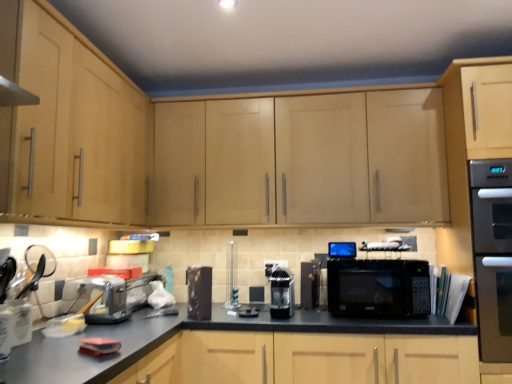
Question: In which direction should I rotate to look at sleek black coffee machine at center, which appears as the third appliance when viewed from the left?

Choices:
 (A) left
 (B) right

Answer: (B)

Question: From the image's perspective, is black plastic microwave at center, acting as the 2th appliance starting from the right, on black glossy microwave at center, the 5th appliance from the left?

Choices:
 (A) yes
 (B) no

Answer: (B)

Question: Is black plastic microwave at center, which is the 4th appliance from left to right, further to the viewer compared to black glossy microwave at center, acting as the first appliance starting from the right?

Choices:
 (A) yes
 (B) no

Answer: (A)

Question: Considering the relative sizes of black plastic microwave at center, acting as the 2th appliance starting from the right, and black glossy microwave at center, acting as the first appliance starting from the right, in the image provided, is black plastic microwave at center, acting as the 2th appliance starting from the right, smaller than black glossy microwave at center, acting as the first appliance starting from the right,?

Choices:
 (A) no
 (B) yes

Answer: (A)

Question: From the image's perspective, is black plastic microwave at center, acting as the 2th appliance starting from the right, located beneath black glossy microwave at center, acting as the first appliance starting from the right?

Choices:
 (A) yes
 (B) no

Answer: (A)

Question: Is there a large distance between black plastic microwave at center, acting as the 2th appliance starting from the right, and black glossy microwave at center, the 5th appliance from the left?

Choices:
 (A) no
 (B) yes

Answer: (A)

Question: Is black plastic microwave at center, which is the 4th appliance from left to right, aimed at black glossy microwave at center, acting as the first appliance starting from the right?

Choices:
 (A) yes
 (B) no

Answer: (B)

Question: Is black plastic microwave at center, which is the 4th appliance from left to right, not near light wood cabinet at upper center, the second cabinetry viewed from the left?

Choices:
 (A) no
 (B) yes

Answer: (A)

Question: Is black plastic microwave at center, which is the 4th appliance from left to right, completely or partially outside of light wood cabinet at upper center, the first cabinetry when ordered from right to left?

Choices:
 (A) yes
 (B) no

Answer: (A)

Question: Is black plastic microwave at center, which is the 4th appliance from left to right, wider than light wood cabinet at upper center, the second cabinetry viewed from the left?

Choices:
 (A) yes
 (B) no

Answer: (B)

Question: Is light wood cabinet at upper center, the first cabinetry when ordered from right to left, completely or partially inside black plastic microwave at center, acting as the 2th appliance starting from the right?

Choices:
 (A) yes
 (B) no

Answer: (B)

Question: Could you tell me if black plastic microwave at center, acting as the 2th appliance starting from the right, is facing light wood cabinet at upper center, the first cabinetry when ordered from right to left?

Choices:
 (A) yes
 (B) no

Answer: (B)

Question: From a real-world perspective, does black plastic microwave at center, which is the 4th appliance from left to right, stand above light wood cabinet at upper center, the second cabinetry viewed from the left?

Choices:
 (A) no
 (B) yes

Answer: (A)

Question: Can stainless steel oven at right be found inside sleek black coffee machine at center, marked as the 3th appliance in a right-to-left arrangement?

Choices:
 (A) no
 (B) yes

Answer: (A)